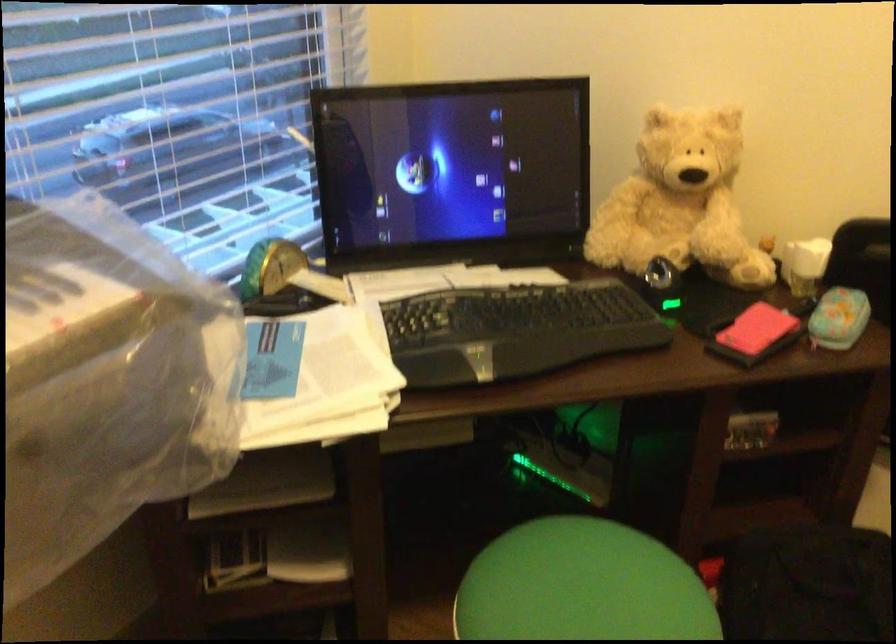
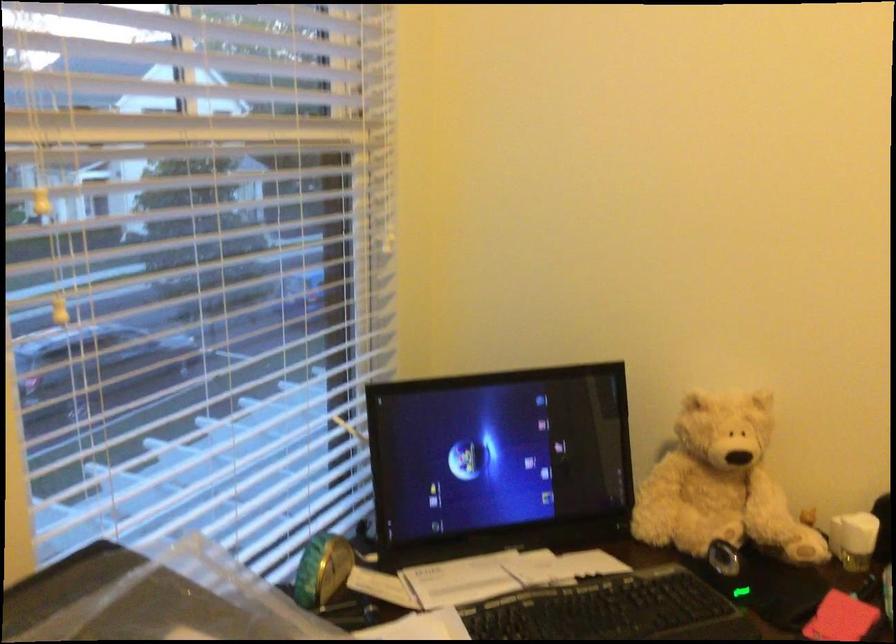
Question: The first image is from the beginning of the video and the second image is from the end. How did the camera likely rotate when shooting the video?

Choices:
 (A) Left
 (B) Right
 (C) Up
 (D) Down

Answer: (C)